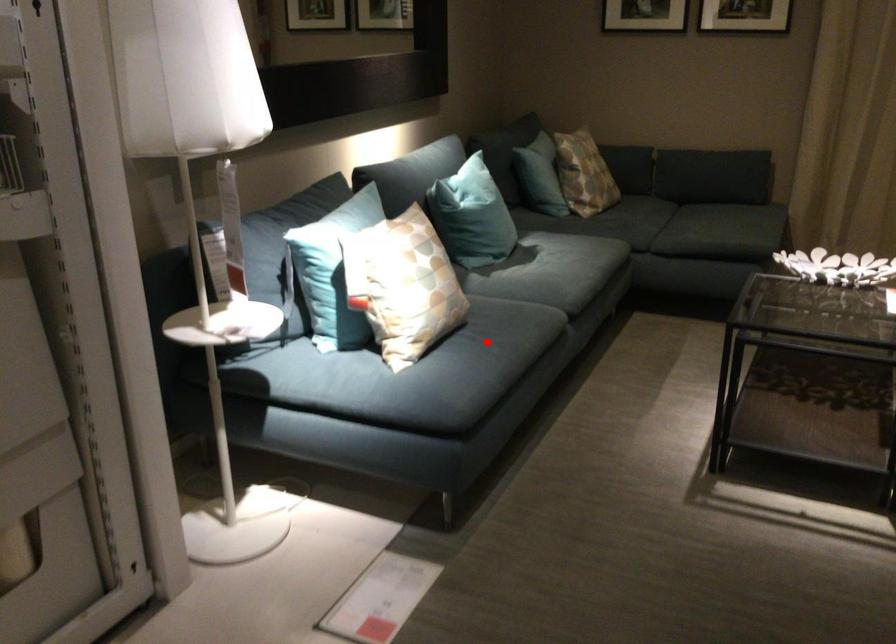
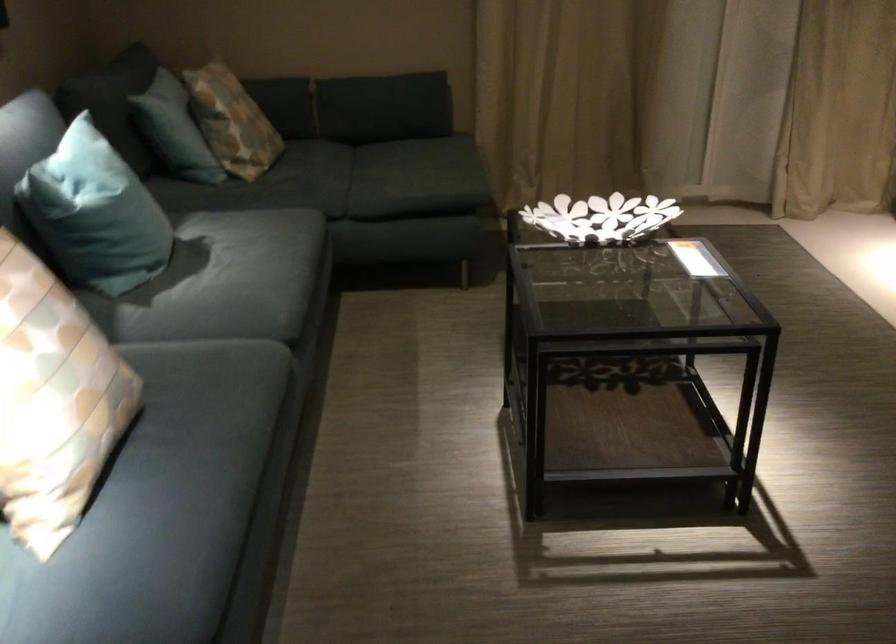
Question: I am providing you with two images of the same scene from different viewpoints. Image1 has a red point marked. In image2, the corresponding 3D location appears at what relative position? Reply with the corresponding letter.

Choices:
 (A) Closer
 (B) Farther

Answer: (A)